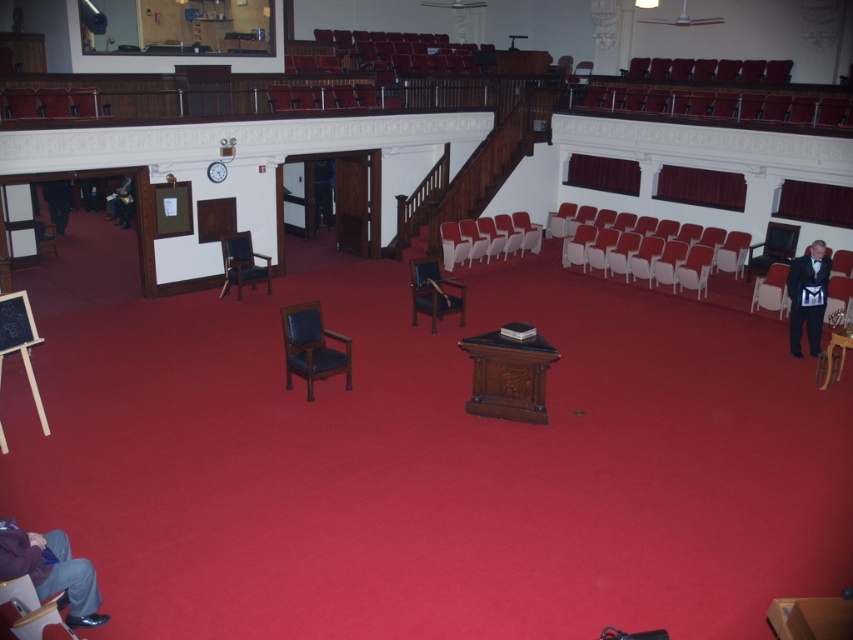
You are organizing an event in this lecture hall and need to place a 3.5 meter long table between the leather wood armchair at center and the dark blue leather armchair at center. Is there enough space to fit the table between them?

The distance between the leather wood armchair at center and the dark blue leather armchair at center is 3.84 meters. Since the table is 3.5 meters long, there is enough space to fit the table between them as 3.5 meters is shorter than 3.84 meters.

You are a stagehand who needs to move a 7.5 meter long banner from the leather wood armchair at center to the matte black armchair at right. Can you fit the banner between them without bending it?

The distance between the leather wood armchair at center and the matte black armchair at right is 7.48 meters, which is slightly shorter than the banner length of 7.5 meters. Therefore, the banner cannot be placed straight between them without bending.

From the picture: You are standing at the entrance of the lecture hall and see the point marked at coordinates (312, 346). What object is located there?

The leather wood armchair at center is located at point (312, 346).